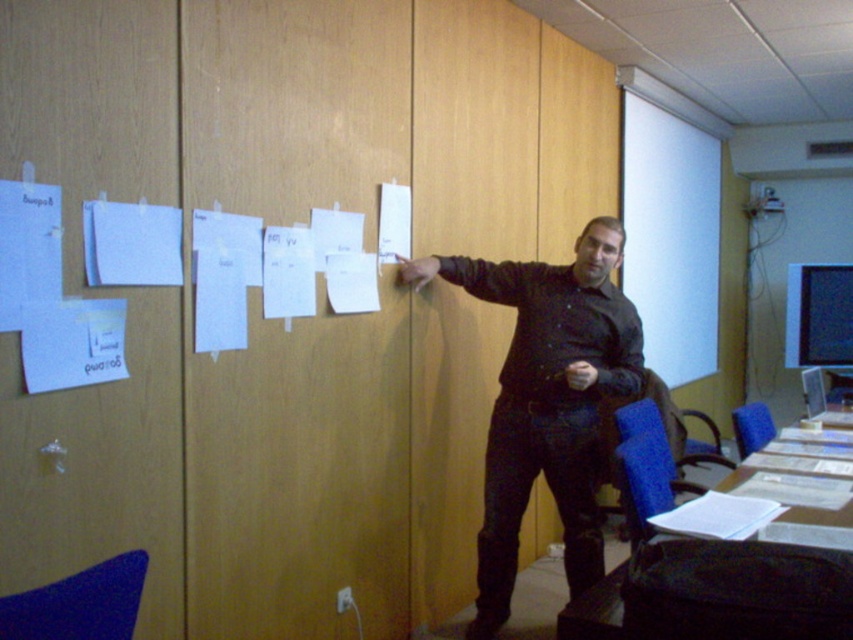
Question: Is black matte shirt at center positioned before white matte paper at upper center?

Choices:
 (A) no
 (B) yes

Answer: (B)

Question: Where is black matte shirt at center located in relation to white matte paper at upper center in the image?

Choices:
 (A) above
 (B) below

Answer: (B)

Question: Which point is closer to the camera?

Choices:
 (A) black matte shirt at center
 (B) white matte paper at upper center

Answer: (A)

Question: Is black matte shirt at center to the left of white matte paper at upper center from the viewer's perspective?

Choices:
 (A) yes
 (B) no

Answer: (A)